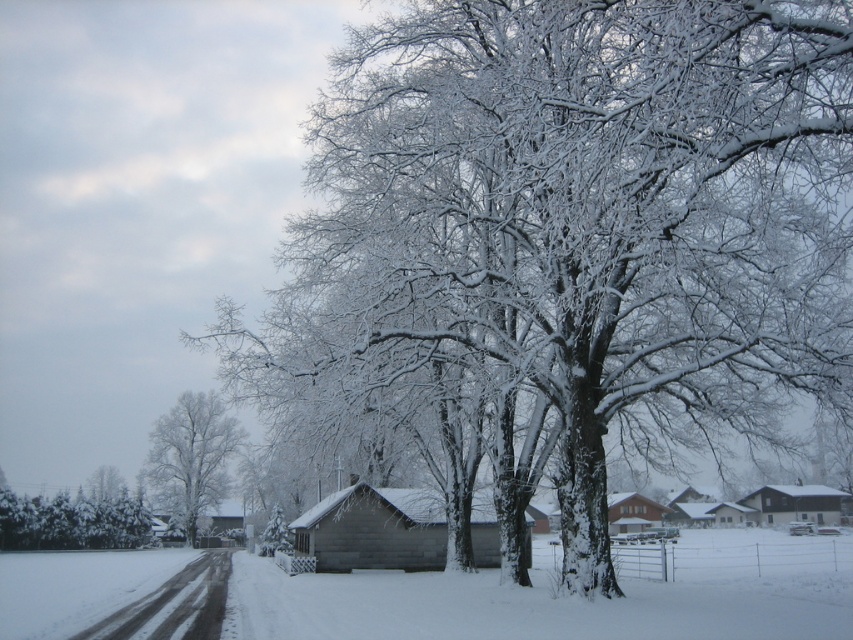
Question: Is snow-covered tree at center closer to the viewer compared to brown wooden house at center-right?

Choices:
 (A) no
 (B) yes

Answer: (B)

Question: Estimate the real-world distances between objects in this image. Which object is farther from the wooden cabin at center?

Choices:
 (A) snow-covered tree at center
 (B) white frosty tree at center
 (C) brown wooden house at center-right

Answer: (A)

Question: Can you confirm if snow-covered tree at center is smaller than brown wooden house at center-right?

Choices:
 (A) no
 (B) yes

Answer: (A)

Question: Does white frosty tree at center appear under wooden cabin at center?

Choices:
 (A) no
 (B) yes

Answer: (A)

Question: Which object is positioned closest to the wooden barn at center?

Choices:
 (A) snow-covered tree at center
 (B) white frosty tree at center
 (C) wooden cabin at center

Answer: (A)

Question: Which of the following is the farthest from the observer?

Choices:
 (A) white frosty tree at center
 (B) brown wooden house at center-right
 (C) wooden cabin at center

Answer: (A)